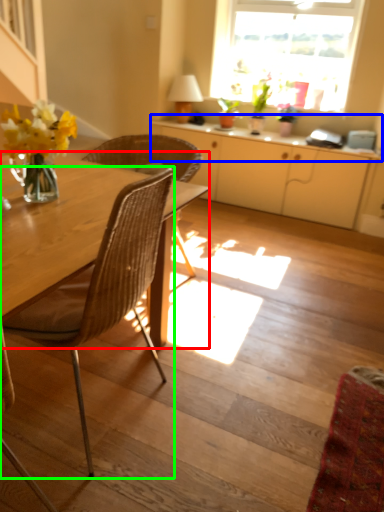
Question: Based on their relative distances, which object is nearer to round table (highlighted by a red box)? Choose from counter top (highlighted by a blue box) and chair (highlighted by a green box).

Choices:
 (A) counter top
 (B) chair

Answer: (B)